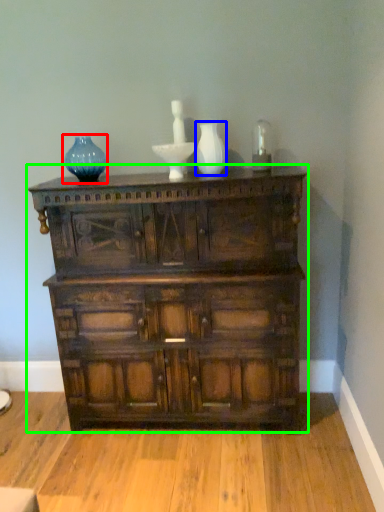
Question: Which object is positioned farthest from vase (highlighted by a red box)? Select from glass vase (highlighted by a blue box) and chest of drawers (highlighted by a green box).

Choices:
 (A) glass vase
 (B) chest of drawers

Answer: (B)